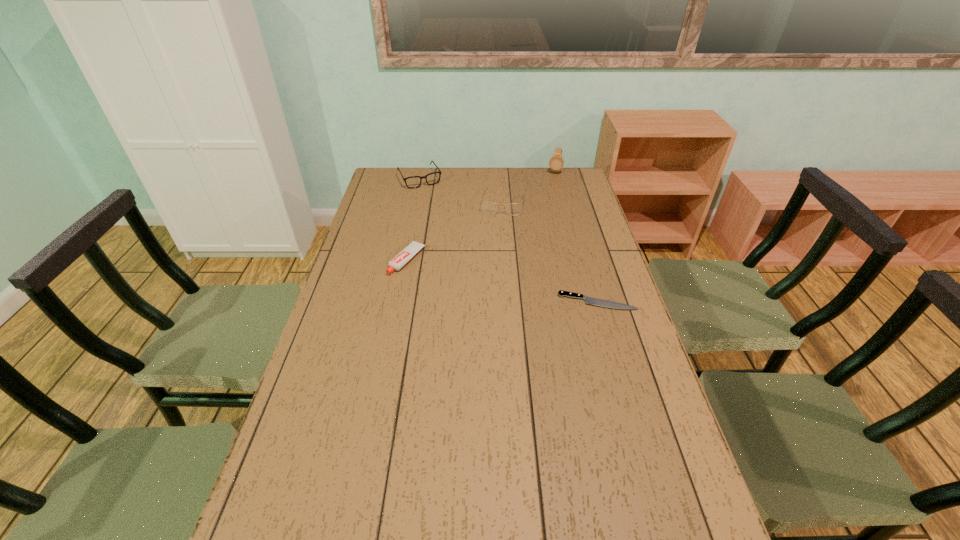
Locate an element on the screen. This screenshot has height=540, width=960. free space on the desktop that is between the toothpaste and the nearest object and is positioned on the front-facing side of the third farthest object is located at coordinates pos(492,279).

The image size is (960, 540). Identify the location of free spot on the desktop that is between the second nearest object and the shortest object and is positioned on the front-facing side of the farther spectacles. (480, 276).

Where is `free space on the desktop that is between the fourth tallest object and the steak knife and is positioned on the face of the watch`? The height and width of the screenshot is (540, 960). free space on the desktop that is between the fourth tallest object and the steak knife and is positioned on the face of the watch is located at coordinates (523, 286).